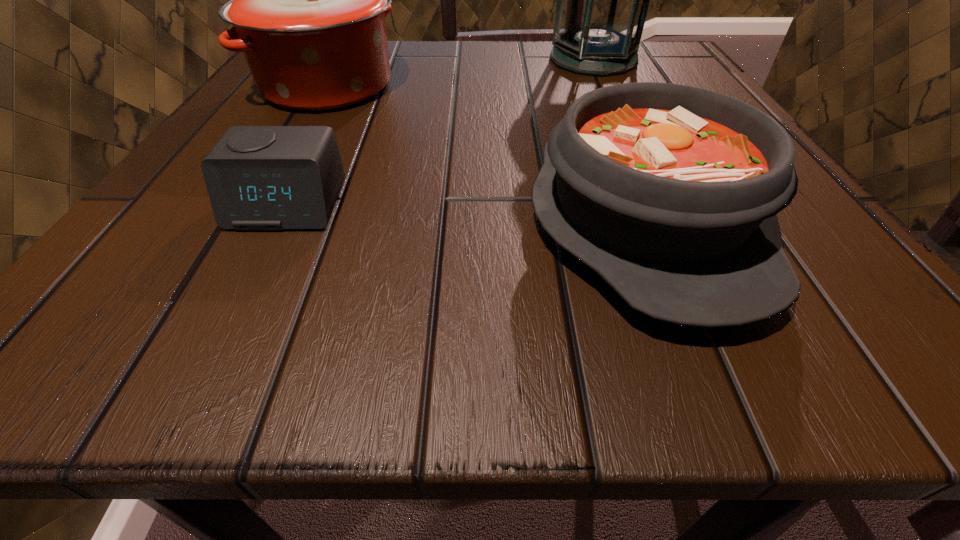
At what (x,y) coordinates should I click in order to perform the action: click on the tallest object. Please return your answer as a coordinate pair (x, y). This screenshot has width=960, height=540. Looking at the image, I should click on (602, 0).

The width and height of the screenshot is (960, 540). I want to click on the left casserole, so click(x=307, y=0).

Where is `the third shortest object`? the third shortest object is located at coordinates click(x=307, y=0).

The image size is (960, 540). I want to click on the right casserole, so click(x=669, y=192).

Locate an element on the screen. This screenshot has height=540, width=960. the second shortest object is located at coordinates (669, 192).

At what (x,y) coordinates should I click in order to perform the action: click on alarm clock. Please return your answer as a coordinate pair (x, y). The height and width of the screenshot is (540, 960). Looking at the image, I should click on (258, 177).

Locate an element on the screen. The width and height of the screenshot is (960, 540). free spot located on the right of the oil lamp is located at coordinates (670, 59).

Identify the location of vacant space located 0.060m on the back of the taller casserole. This screenshot has width=960, height=540. (349, 46).

This screenshot has width=960, height=540. I want to click on free spot located 0.220m on the back of the nearer casserole, so click(586, 78).

Where is `free space located on the front-facing side of the shortest object`? The width and height of the screenshot is (960, 540). free space located on the front-facing side of the shortest object is located at coordinates (204, 370).